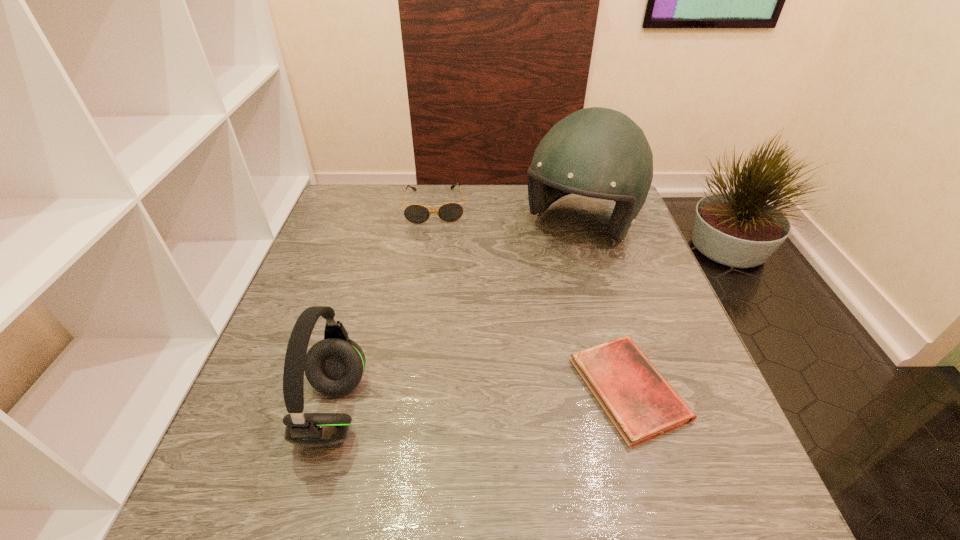
Where is `vacant space on the desktop that is between the third shortest object and the diary and is positioned on the lenses of the third tallest object`? vacant space on the desktop that is between the third shortest object and the diary and is positioned on the lenses of the third tallest object is located at coordinates (443, 403).

You are a GUI agent. You are given a task and a screenshot of the screen. Output one action in this format:
    pyautogui.click(x=<x>, y=<y>)
    Task: Click on the vacant space on the desktop that is between the third shortest object and the shortest object and is positioned at the face opening of the football helmet
    
    Given the screenshot: What is the action you would take?
    pyautogui.click(x=450, y=402)